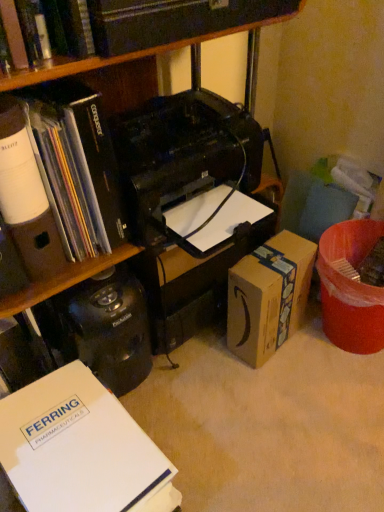
I want to click on vacant area located to the right-hand side of brown cardboard box at lower right, so click(x=313, y=359).